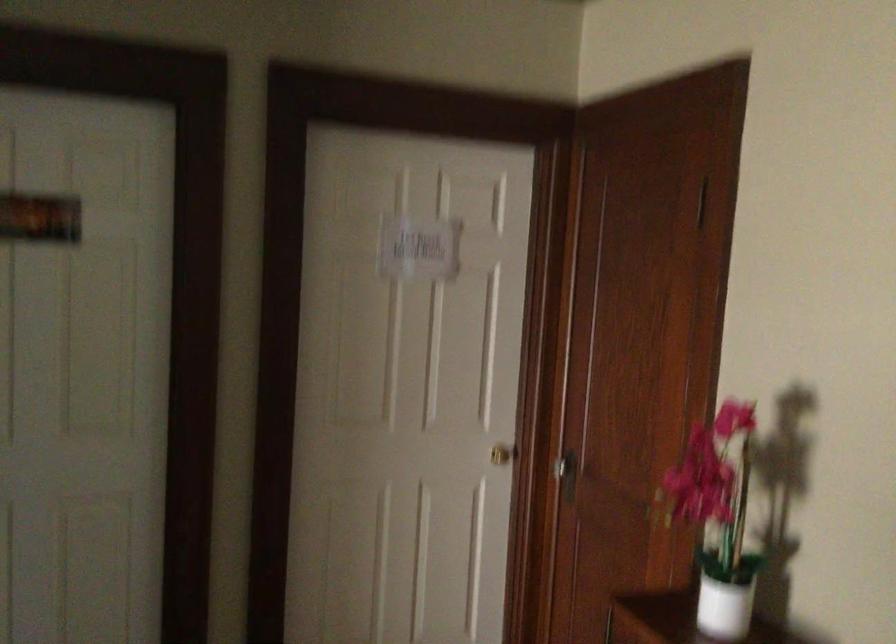
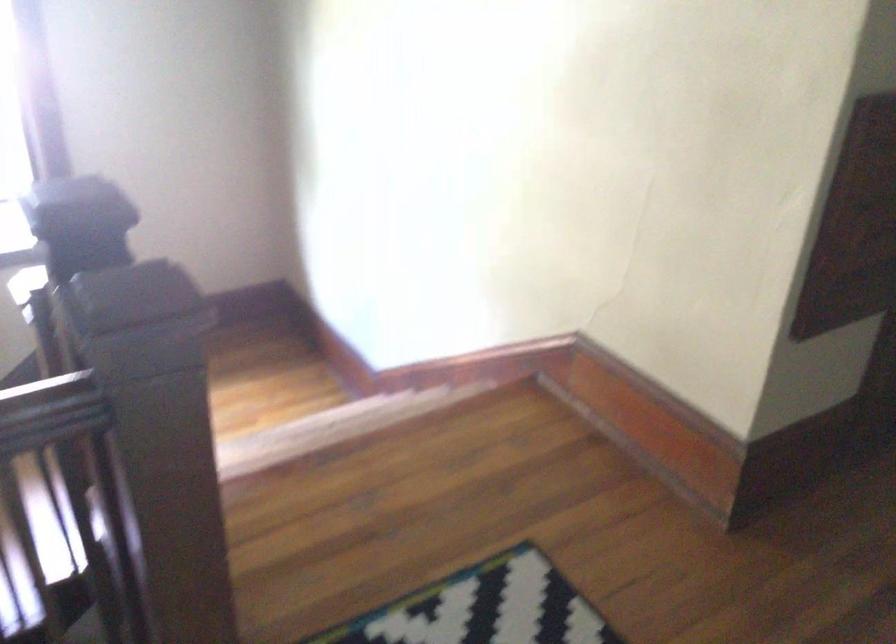
First-person continuous shooting, in which direction is the camera rotating?

The camera's rotation is toward left-down.